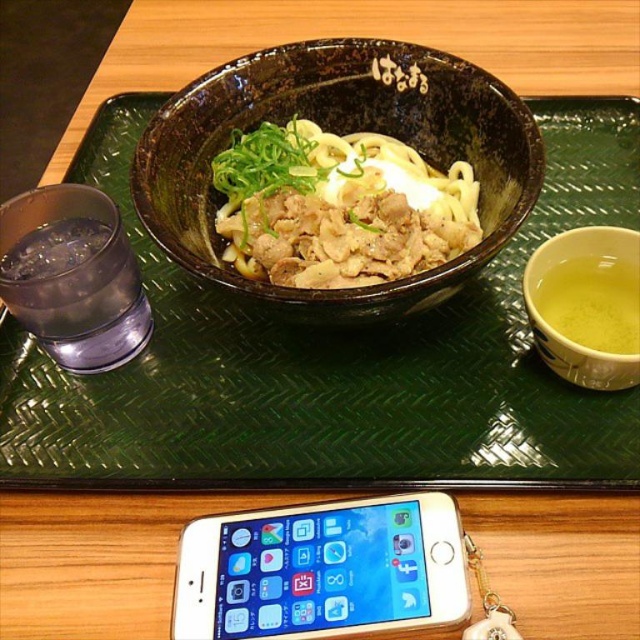
Between point (552, 444) and point (314, 612), which one is positioned behind?

The point (552, 444) is more distant.

Does green textured tray at center have a greater height compared to gold metallic smartphone at lower center?

Indeed, green textured tray at center has a greater height compared to gold metallic smartphone at lower center.

Find the location of a particular element. green textured tray at center is located at coordinates tap(333, 362).

Between black glazed bowl at center and gold metallic smartphone at lower center, which one appears on the right side from the viewer's perspective?

From the viewer's perspective, black glazed bowl at center appears more on the right side.

Between black glazed bowl at center and gold metallic smartphone at lower center, which one is positioned higher?

black glazed bowl at center

What do you see at coordinates (339, 132) in the screenshot? This screenshot has height=640, width=640. I see `black glazed bowl at center` at bounding box center [339, 132].

What are the coordinates of `black glazed bowl at center` in the screenshot? It's located at (339, 132).

Who is more distant from viewer, (211, 106) or (237, 141)?

The point (237, 141) is behind.

Does black glazed bowl at center lie behind shiny brown bowl at center?

No, it is in front of shiny brown bowl at center.

Between point (458, 125) and point (365, 209), which one is positioned in front?

Point (365, 209) is more forward.

Identify the location of black glazed bowl at center. Image resolution: width=640 pixels, height=640 pixels. (339, 132).